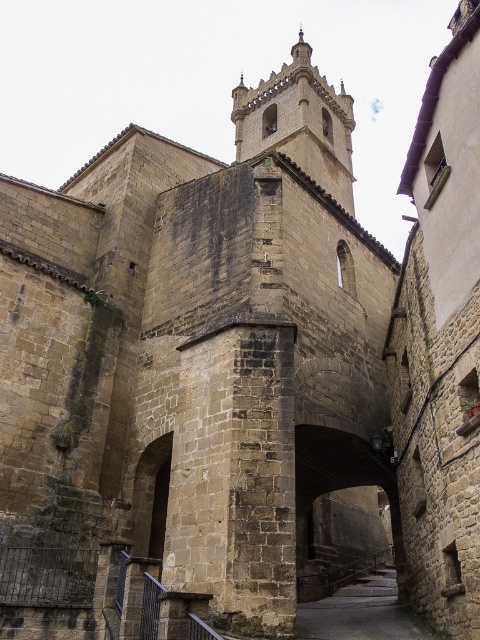
Question: Is brown stone tower at center thinner than dark stone archway at center?

Choices:
 (A) no
 (B) yes

Answer: (A)

Question: Can you confirm if brown stone tower at center is positioned to the left of stone paved alley at center?

Choices:
 (A) yes
 (B) no

Answer: (B)

Question: Is stone paved alley at center closer to the viewer compared to dark stone archway at center?

Choices:
 (A) no
 (B) yes

Answer: (B)

Question: Which point is closer to the camera taking this photo?

Choices:
 (A) (289, 100)
 (B) (313, 616)

Answer: (B)

Question: Which of the following is the farthest from the observer?

Choices:
 (A) (295, 160)
 (B) (373, 468)
 (C) (374, 634)

Answer: (A)

Question: Which of these objects is positioned closest to the brown stone tower at center?

Choices:
 (A) stone paved alley at center
 (B) dark stone archway at center

Answer: (B)